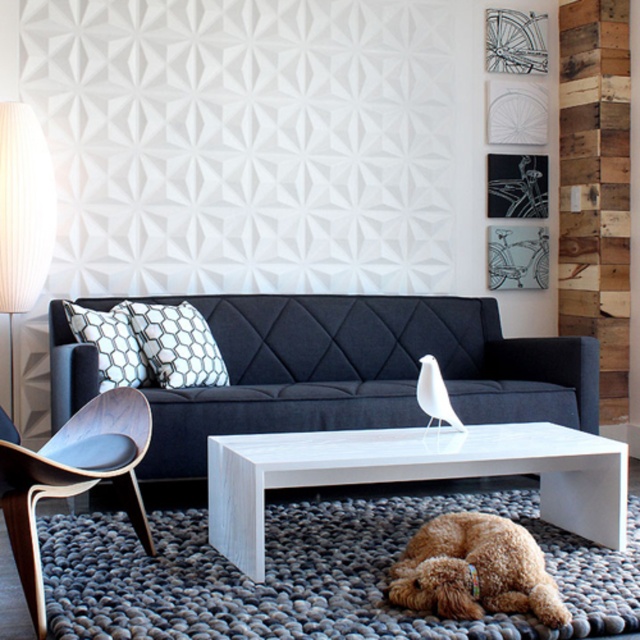
You are sitting on the dark blue fabric couch at center and want to reach the white hexagonal pillow at center. Is the pillow within arm s length?

The dark blue fabric couch at center is closer to the viewer than the white hexagonal pillow at center, so the pillow is further away. It might not be within arm s length.

You are standing in the living room and want to sit down. There is a wooden armchair at left and a dark blue tufted sofa against the wall with geometric honeycomb throw pillows. Which piece of furniture is closer to your current position at point (74, 477)?

The wooden armchair at left is located at point (74, 477), so you are already at the wooden armchair at left.

You are a guest entering the living room and want to sit down. You see the wooden armchair at left and the brown furry dog at lower center. Which object is closer to the entrance?

The wooden armchair at left is closer to the entrance because it is positioned over the brown furry dog at lower center, indicating it is in front of the dog and thus nearer to the entrance.